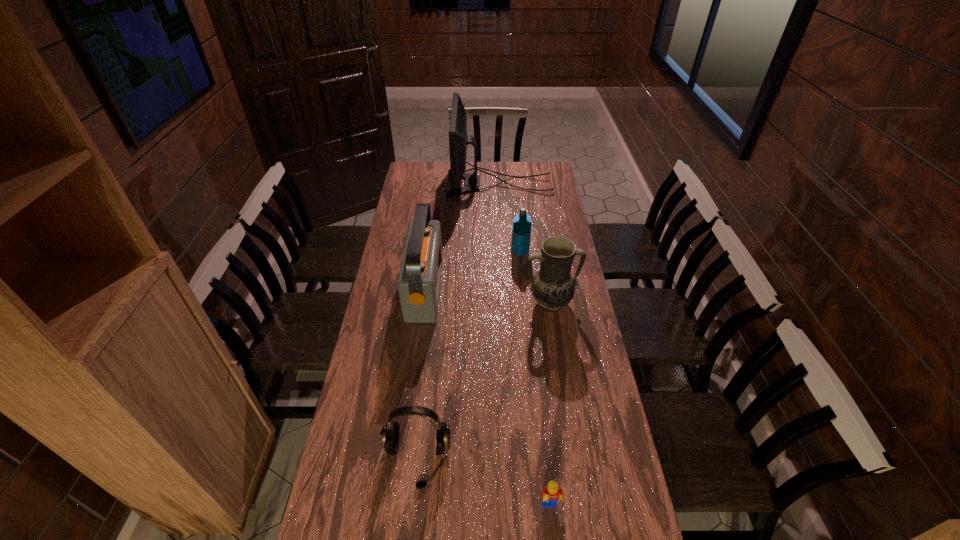
Where is `computer monitor`? The height and width of the screenshot is (540, 960). computer monitor is located at coordinates (458, 140).

Find the location of `the farthest object`. the farthest object is located at coordinates (458, 140).

You are a GUI agent. You are given a task and a screenshot of the screen. Output one action in this format:
    pyautogui.click(x=<x>, y=<y>)
    Task: Click on the radio receiver
    
    Given the screenshot: What is the action you would take?
    pyautogui.click(x=419, y=278)

This screenshot has width=960, height=540. Find the location of `pottery`. pottery is located at coordinates (553, 287).

Find the location of `thermos bottle`. thermos bottle is located at coordinates (521, 231).

The width and height of the screenshot is (960, 540). I want to click on the fifth farthest object, so click(390, 432).

The image size is (960, 540). Identify the location of the nearest object. (550, 495).

Locate an element on the screen. Image resolution: width=960 pixels, height=540 pixels. Lego is located at coordinates (550, 495).

Find the location of a particular element. The height and width of the screenshot is (540, 960). blank area located 0.170m on the screen side of the computer monitor is located at coordinates (415, 184).

Locate an element on the screen. free space located 0.070m on the screen side of the computer monitor is located at coordinates (434, 184).